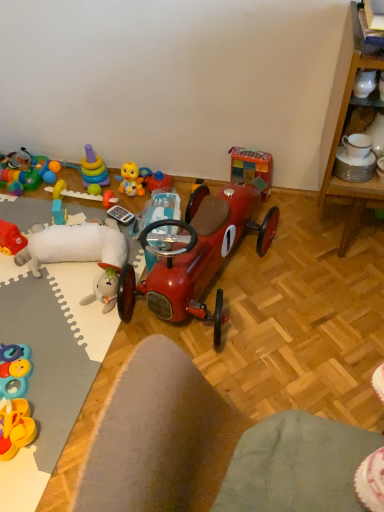
The image size is (384, 512). In order to click on free space in front of rubber duck at left, marked as the 10th toy in a right-to-left arrangement in this screenshot , I will do `click(14, 273)`.